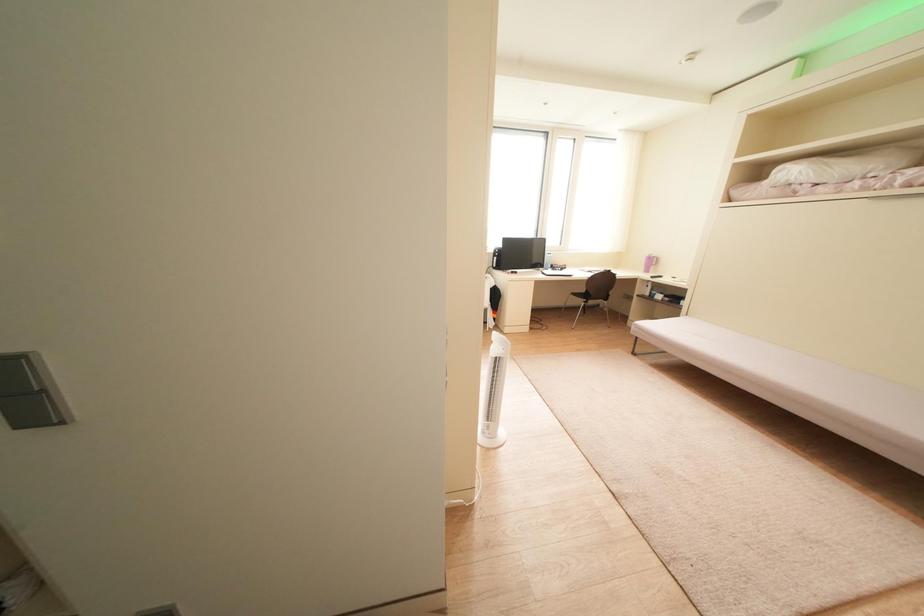
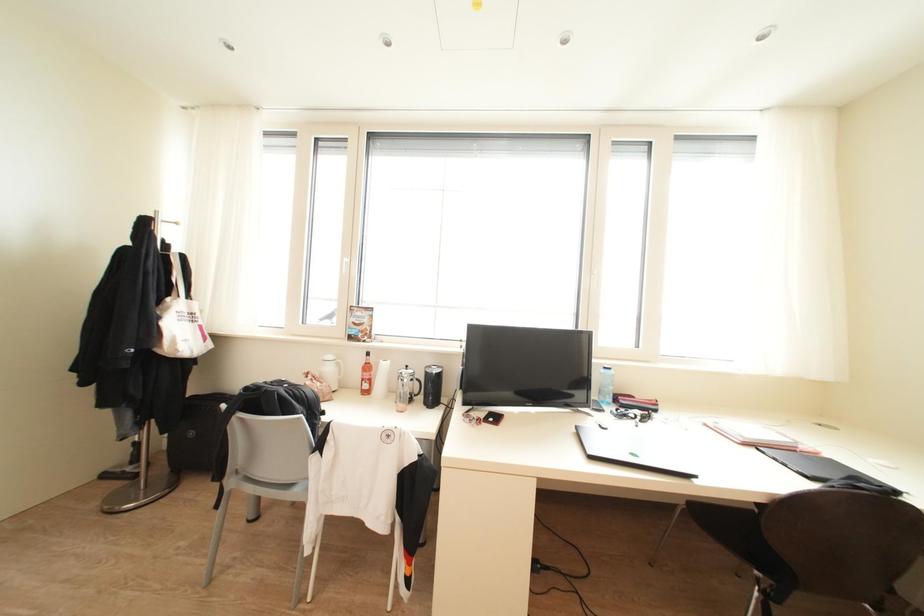
In a continuous first-person perspective shot, in which direction is the camera moving?

The cameraman walked toward right, forward.